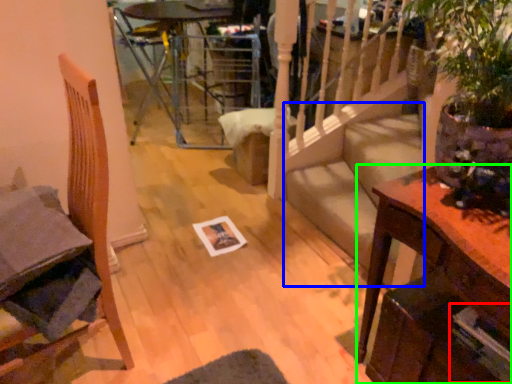
Question: Estimate the real-world distances between objects in this image. Which object is farther from magazine (highlighted by a red box), stairwell (highlighted by a blue box) or table (highlighted by a green box)?

Choices:
 (A) stairwell
 (B) table

Answer: (A)